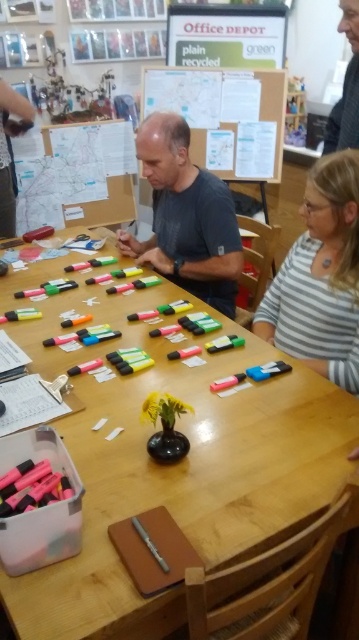
Question: Observing the image, what is the correct spatial positioning of white striped shirt at upper right in reference to matte black shirt at upper right?

Choices:
 (A) above
 (B) below

Answer: (B)

Question: Estimate the real-world distances between objects in this image. Which object is farther from the dark gray shirt at center?

Choices:
 (A) white striped shirt at upper right
 (B) white paperboard at upper center

Answer: (B)

Question: Which of the following is the farthest from the observer?

Choices:
 (A) (x=290, y=342)
 (B) (x=156, y=129)

Answer: (B)

Question: Which point is farther from the camera taking this photo?

Choices:
 (A) (353, 132)
 (B) (300, 406)
 (C) (229, 172)
 (D) (170, 248)

Answer: (C)

Question: Can you confirm if dark gray shirt at center is thinner than matte black shirt at upper right?

Choices:
 (A) no
 (B) yes

Answer: (A)

Question: Is dark gray shirt at center smaller than matte black marker at upper left?

Choices:
 (A) no
 (B) yes

Answer: (A)